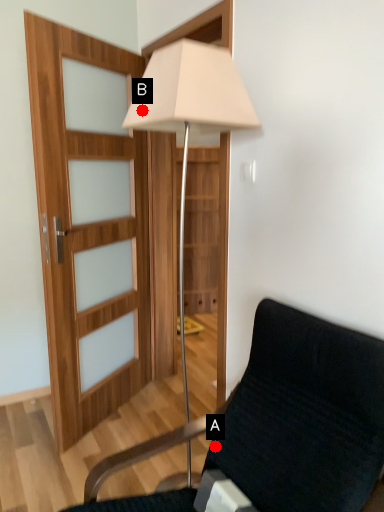
Question: Two points are circled on the image, labeled by A and B beside each circle. Among these points, which one is farthest from the camera?

Choices:
 (A) A is further
 (B) B is further

Answer: (A)